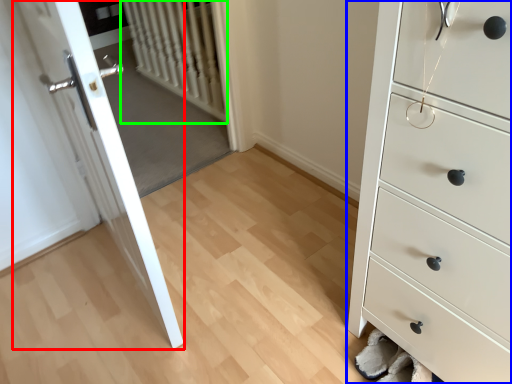
Question: Which is farther away from door (highlighted by a red box)? chest of drawers (highlighted by a blue box) or radiator (highlighted by a green box)?

Choices:
 (A) chest of drawers
 (B) radiator

Answer: (B)